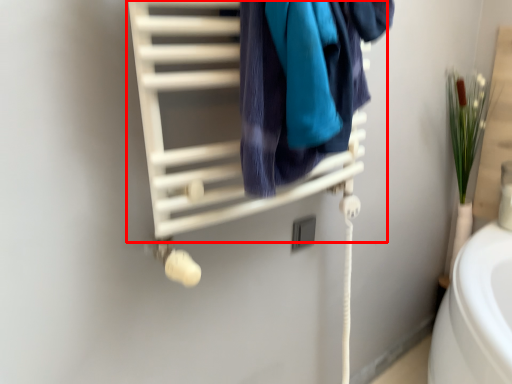
Question: Considering the relative positions of closet (annotated by the red box) and towel in the image provided, where is closet (annotated by the red box) located with respect to the staircase?

Choices:
 (A) left
 (B) right

Answer: (A)